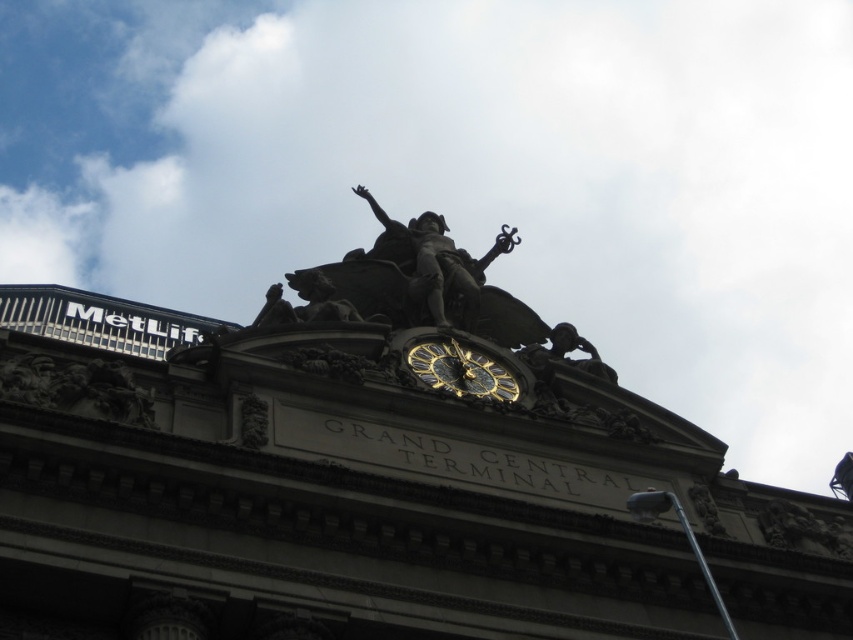
You are standing at the base of Grand Central Terminal and want to take a photo of the point marked at coordinates point (x=421, y=289). If your camera has a maximum zoom range of 100 feet, will you be able to capture the point in your photo?

The point marked at coordinates point (x=421, y=289) is 216.01 feet away from the viewer. Since the camera can only zoom up to 100 feet, the point is too far to be captured in the photo.

You are standing at the entrance of Grand Central Terminal and want to take a photo of the bronze statue at center. If your camera can capture objects up to 60 meters away, will you be able to take the photo from where you are?

The bronze statue at center and camera are 62.84 meters apart from each other, which is beyond the camera range of 60 meters. Therefore, you cannot take the photo from where you are.